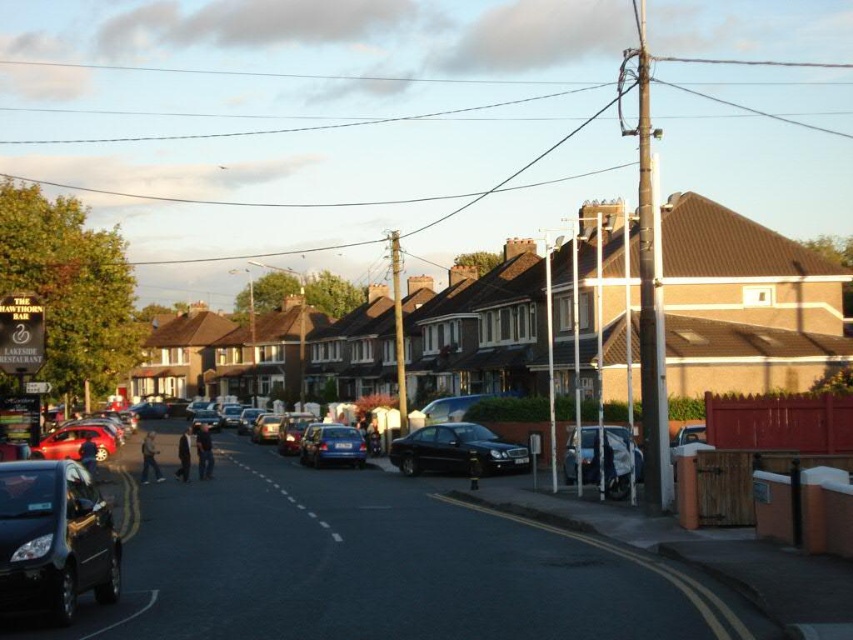
You are a pedestrian standing on the sidewalk and want to cross the street to reach a store across. There are two shiny black vehicles in your view. Based on their positions, which vehicle is closer to you, the pedestrian, between the shiny black car at lower left and the shiny black sedan at center?

The shiny black car at lower left is closer to you because it is positioned above the shiny black sedan at center, indicating it is nearer in the visual perspective.